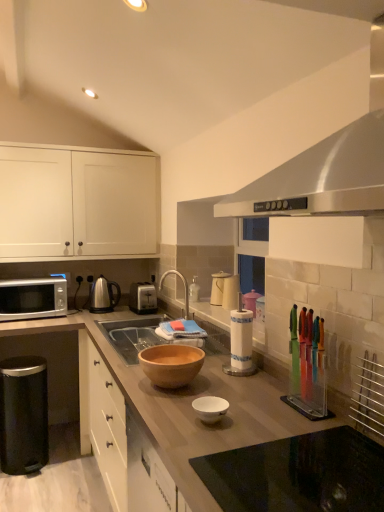
Question: From the image's perspective, relative to metallic silver rack at right, which is the 5th appliance in back-to-front order, is satin silver exhaust hood at upper center above or below?

Choices:
 (A) above
 (B) below

Answer: (A)

Question: Relative to metallic silver rack at right, the first appliance positioned from the front, is satin silver exhaust hood at upper center in front or behind?

Choices:
 (A) front
 (B) behind

Answer: (A)

Question: Estimate the real-world distances between objects in this image. Which object is closer to the black matte trash can at lower left, the fifth appliance when ordered from right to left?

Choices:
 (A) silver metallic microwave at left, which is the first countertop from back to front
 (B) black glass cooktop at lower center, the 1th countertop in the right-to-left sequence
 (C) satin silver toaster at center, positioned as the first appliance in back-to-front order
 (D) matte silver faucet at center
 (E) wooden bowl at center, the first bowl viewed from the back

Answer: (A)

Question: Estimate the real-world distances between objects in this image. Which object is farther from the white matte cabinet at upper left?

Choices:
 (A) matte white kettle at center, which is the third appliance in right-to-left order
 (B) translucent plastic knife block at right, which is counted as the second appliance, starting from the right
 (C) satin nickel tea pot at center
 (D) metallic silver rack at right, the first appliance positioned from the right
 (E) black glass cooktop at lower center, placed as the first countertop when sorted from front to back

Answer: (D)